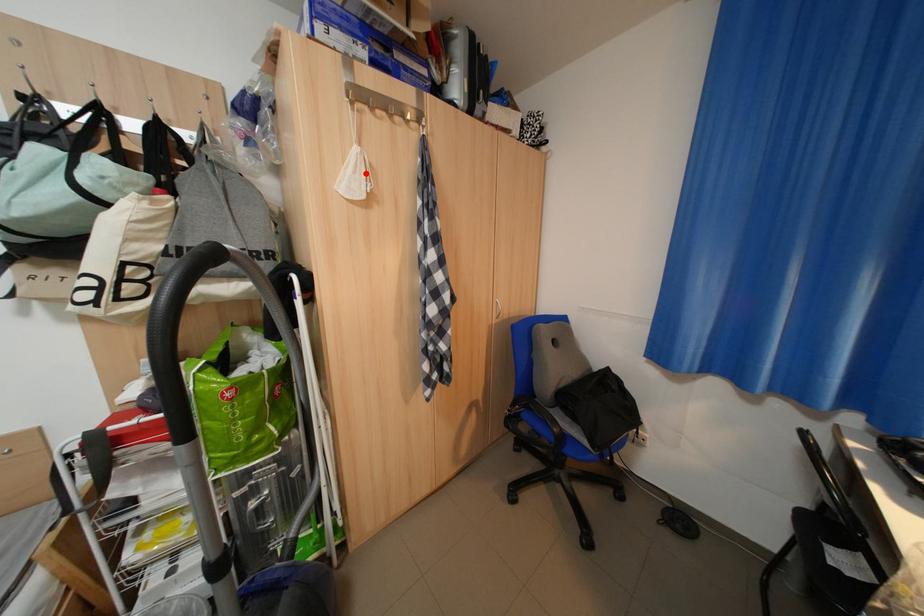
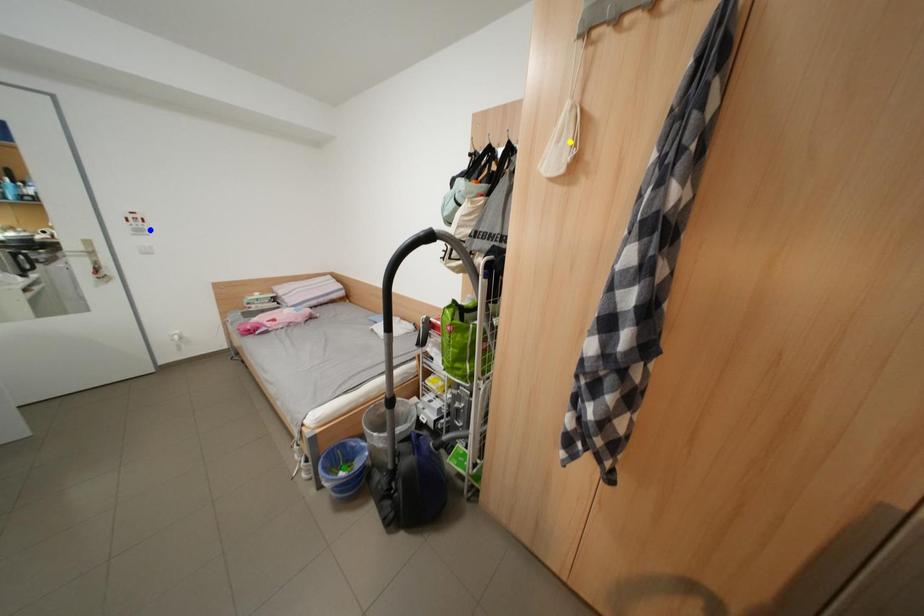
Question: I am providing you with two images of the same scene from different viewpoints. A red point is marked on the first image. You are given multiple points on the second image. Which mark in image 2 goes with the point in image 1?

Choices:
 (A) green point
 (B) yellow point
 (C) blue point

Answer: (B)